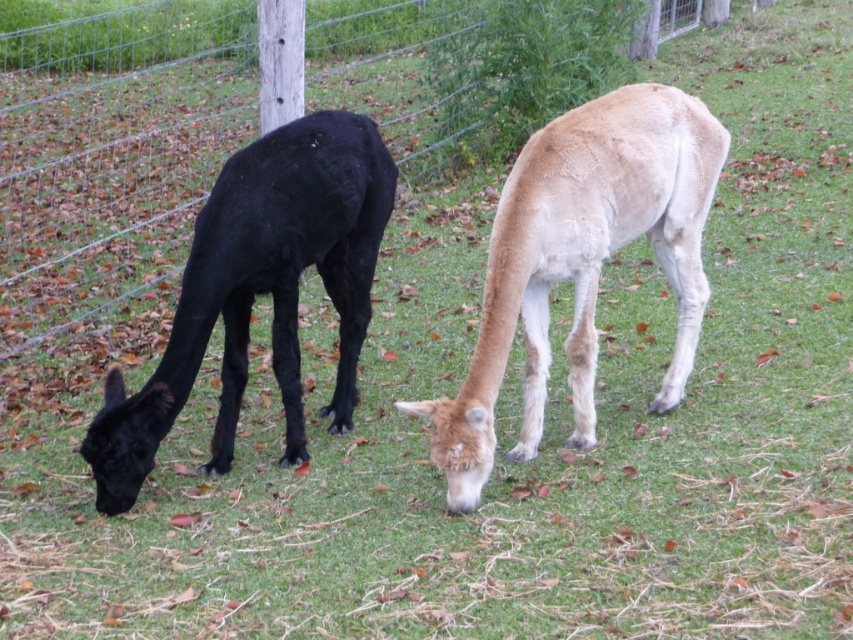
You are a farmer checking on your animals. You notice the light brown woolen alpaca at center and the shiny black llama at left. Which animal would cast a larger shadow if the sun is directly overhead?

The light brown woolen alpaca at center is bigger than the shiny black llama at left, so it would cast a larger shadow.

You are standing in the field where the two alpacas are grazing. You notice two points marked on the ground at coordinates point (495, 244) and point (247, 164). Which point is nearer to you?

Point (495, 244) is closer to the camera than point (247, 164), so the point nearer to you is point (495, 244).

You are standing at the origin point of a coordinate system where the bottom left corner of the image is the origin. The image has a width of 1 unit and a height of 1 unit. You want to walk to the light brown woolen alpaca at center. In which direction should you move first?

The light brown woolen alpaca at center is located at coordinates approximately 0.411 units to the right and 0.682 units up from the origin. Since you are at the origin, you should first move to the right to reach the alpaca.